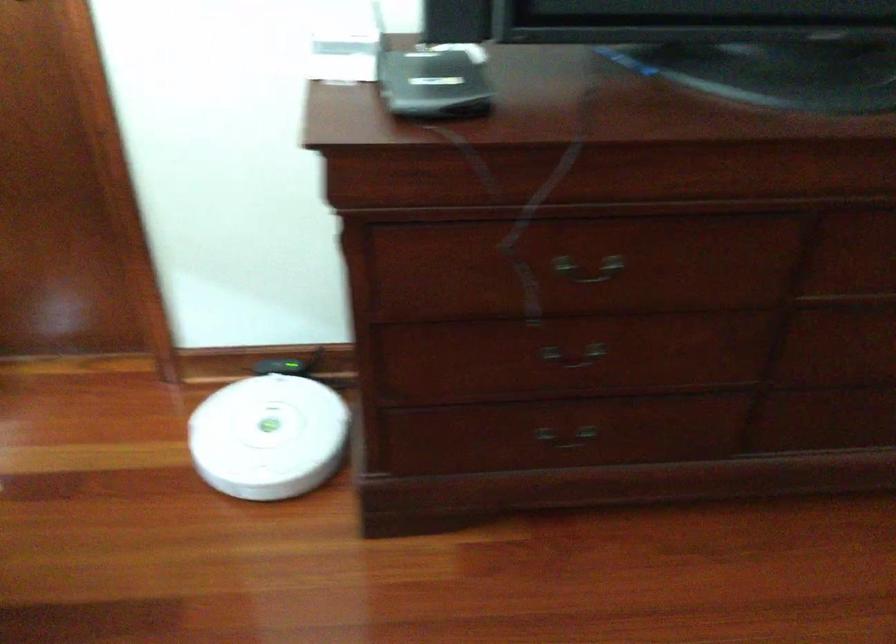
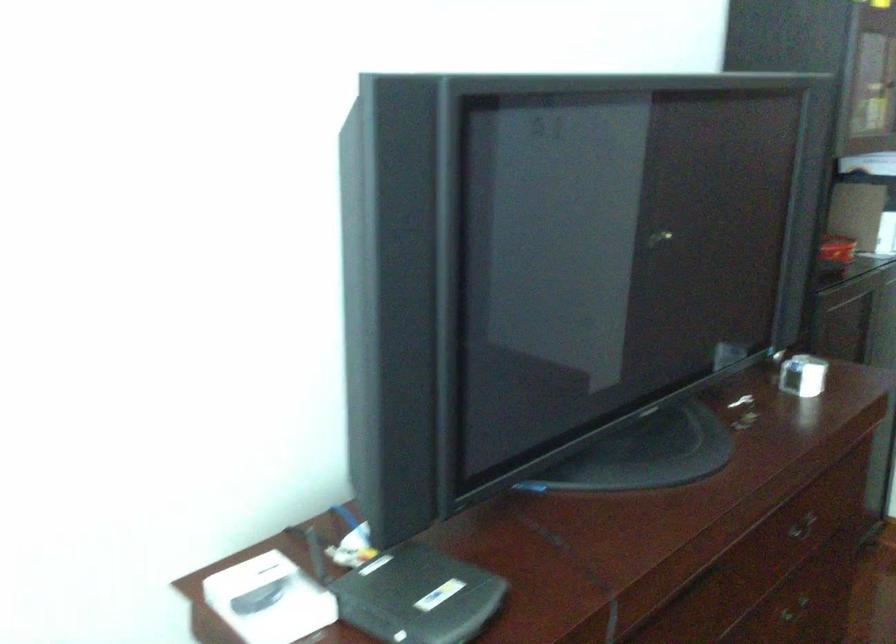
Question: The camera is either moving clockwise (left) or counter-clockwise (right) around the object. The first image is from the beginning of the video and the second image is from the end. Is the camera moving left or right when shooting the video?

Choices:
 (A) Left
 (B) Right

Answer: (A)